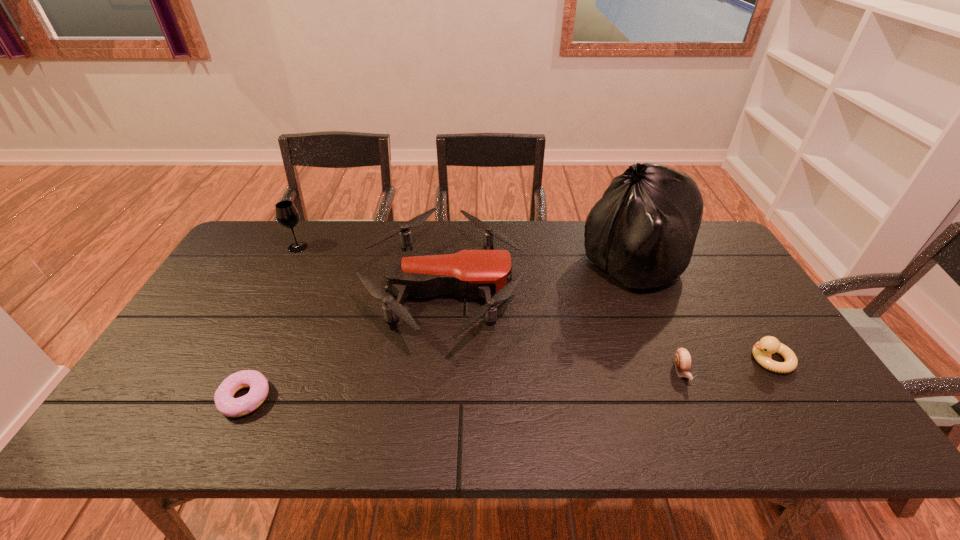
This screenshot has height=540, width=960. What are the coordinates of `the third closest object to the fifth shortest object` in the screenshot? It's located at (642, 232).